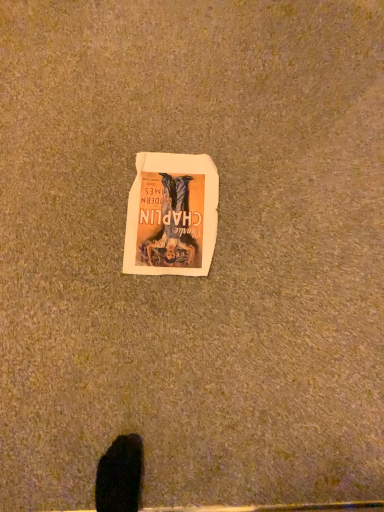
Locate an element on the screen. This screenshot has height=512, width=384. vacant region in front of matte paper poster at center is located at coordinates (145, 313).